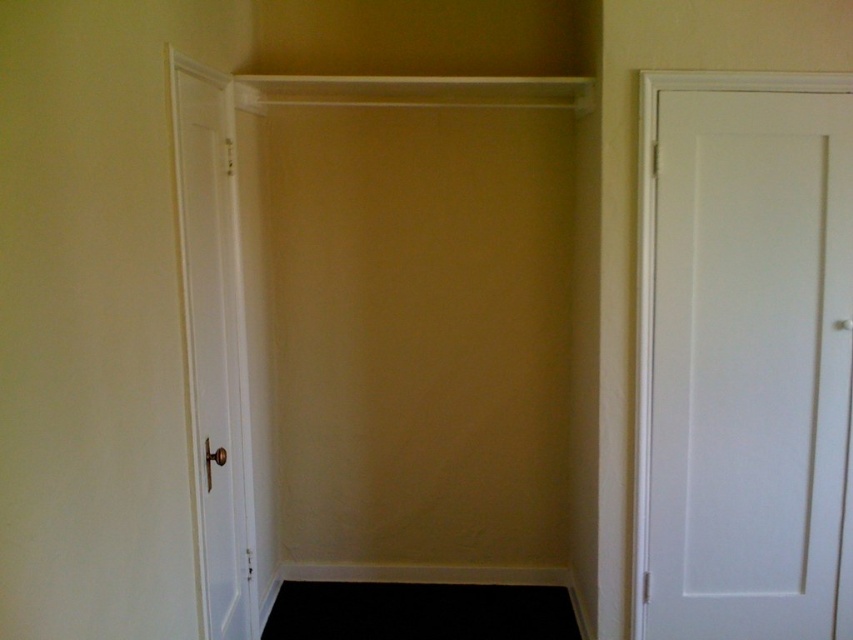
Who is shorter, white smooth door at right or white smooth door at left?

Standing shorter between the two is white smooth door at right.

The width and height of the screenshot is (853, 640). What do you see at coordinates (746, 358) in the screenshot? I see `white smooth door at right` at bounding box center [746, 358].

Image resolution: width=853 pixels, height=640 pixels. Identify the location of white smooth door at right. (746, 358).